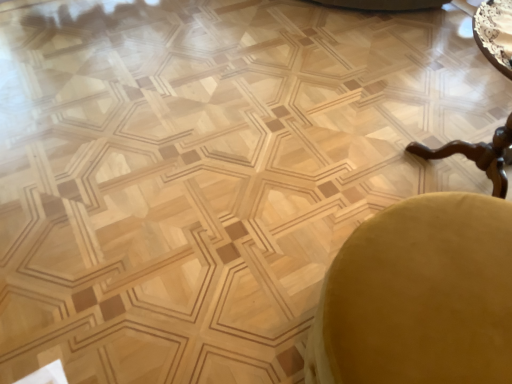
I want to click on unoccupied area behind wooden polished table at right, so click(x=424, y=102).